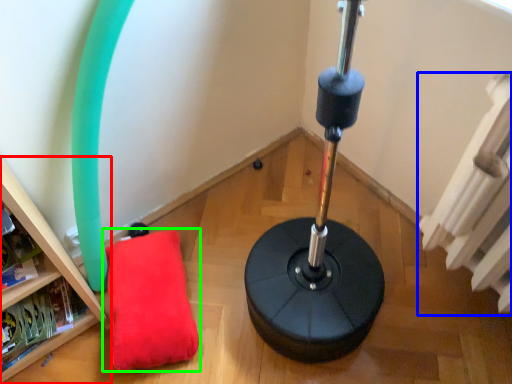
Question: Based on their relative distances, which object is nearer to furniture (highlighted by a red box)? Choose from radiator (highlighted by a blue box) and pillow (highlighted by a green box).

Choices:
 (A) radiator
 (B) pillow

Answer: (B)